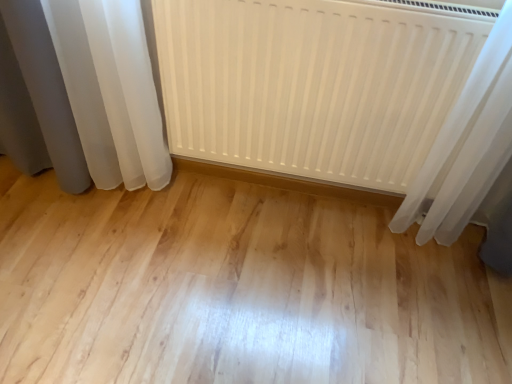
What do you see at coordinates (315, 82) in the screenshot?
I see `white matte radiator at center` at bounding box center [315, 82].

The image size is (512, 384). In order to click on white matte radiator at center in this screenshot , I will do `click(315, 82)`.

The height and width of the screenshot is (384, 512). I want to click on white matte radiator at center, so click(315, 82).